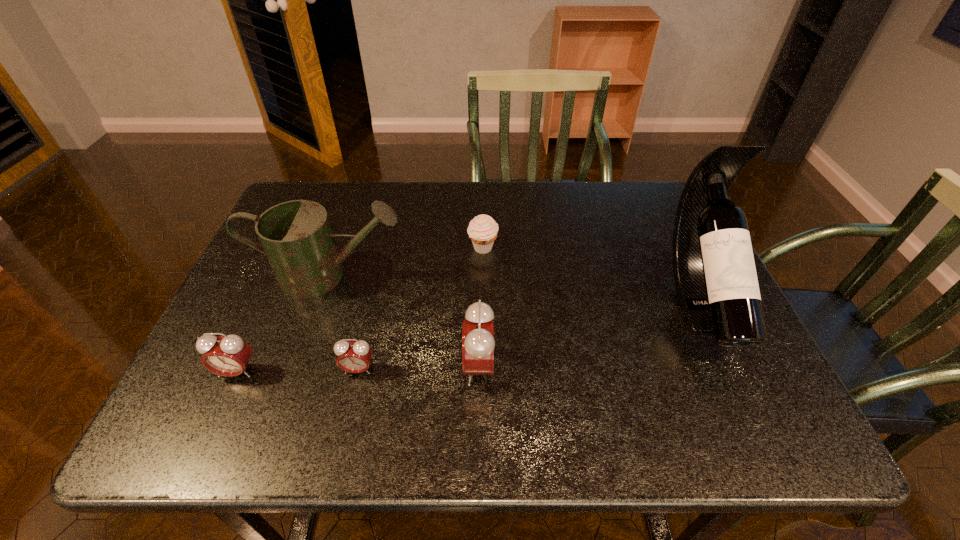
The image size is (960, 540). What are the coordinates of `free space between the second tallest alarm clock and the shortest alarm clock` in the screenshot? It's located at (298, 370).

In order to click on free spot between the leftmost alarm clock and the muffin in this screenshot , I will do `click(360, 310)`.

Identify the location of vacant area that lies between the leftmost alarm clock and the muffin. The image size is (960, 540). (360, 310).

Identify the location of object identified as the fifth closest to the muffin. (229, 355).

At what (x,y) coordinates should I click in order to perform the action: click on object that can be found as the second closest to the second tallest object. Please return your answer as a coordinate pair (x, y). This screenshot has height=540, width=960. Looking at the image, I should click on (354, 357).

Identify which alarm clock is the second nearest to the leftmost alarm clock. Please provide its 2D coordinates. Your answer should be formatted as a tuple, i.e. [(x, y)], where the tuple contains the x and y coordinates of a point satisfying the conditions above.

[(478, 343)]

Identify which alarm clock is the second closest to the leftmost alarm clock. Please provide its 2D coordinates. Your answer should be formatted as a tuple, i.e. [(x, y)], where the tuple contains the x and y coordinates of a point satisfying the conditions above.

[(478, 343)]

You are a GUI agent. You are given a task and a screenshot of the screen. Output one action in this format:
    pyautogui.click(x=<x>, y=<y>)
    Task: Click on the vacant space that satisfies the following two spatial constraints: 1. on the clock face of the tallest alarm clock; 2. on the clock face of the leftmost alarm clock
    
    Given the screenshot: What is the action you would take?
    pyautogui.click(x=479, y=372)

Find the location of a particular element. This screenshot has width=960, height=540. vacant point that satisfies the following two spatial constraints: 1. on the clock face of the tallest alarm clock; 2. on the clock face of the shortest alarm clock is located at coordinates tap(479, 369).

Where is `free space that satisfies the following two spatial constraints: 1. with the spout on the watering can; 2. on the clock face of the second tallest alarm clock`? This screenshot has height=540, width=960. free space that satisfies the following two spatial constraints: 1. with the spout on the watering can; 2. on the clock face of the second tallest alarm clock is located at coordinates (296, 372).